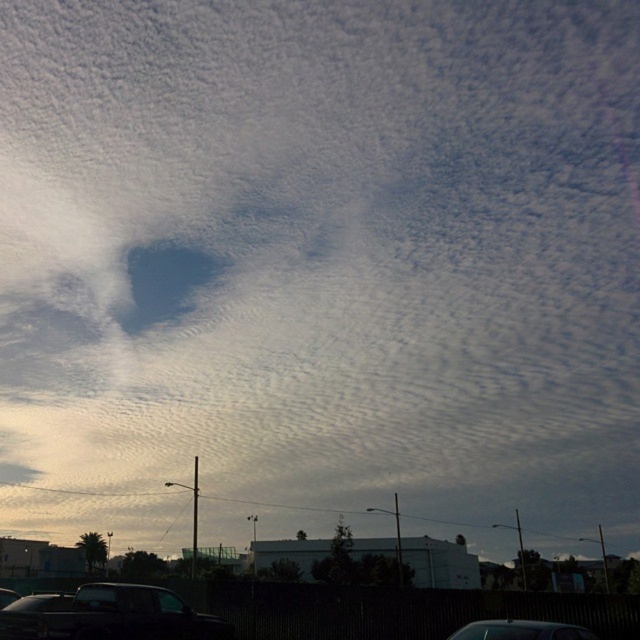
You are a pedestrian standing on the sidewalk and see the dark gray metallic car at lower left and the shiny black car at bottom. Which car is closer to the ground?

The dark gray metallic car at lower left is below the shiny black car at bottom, so it is closer to the ground.

You are a photographer planning to capture a landscape shot that includes both the dark gray metallic car at lower left and the shiny black car at bottom. Considering their sizes in the image, which car should you focus on to ensure it stands out more in your composition?

A: The dark gray metallic car at lower left has a larger size compared to the shiny black car at bottom, so focusing on it will make it stand out more in the composition.